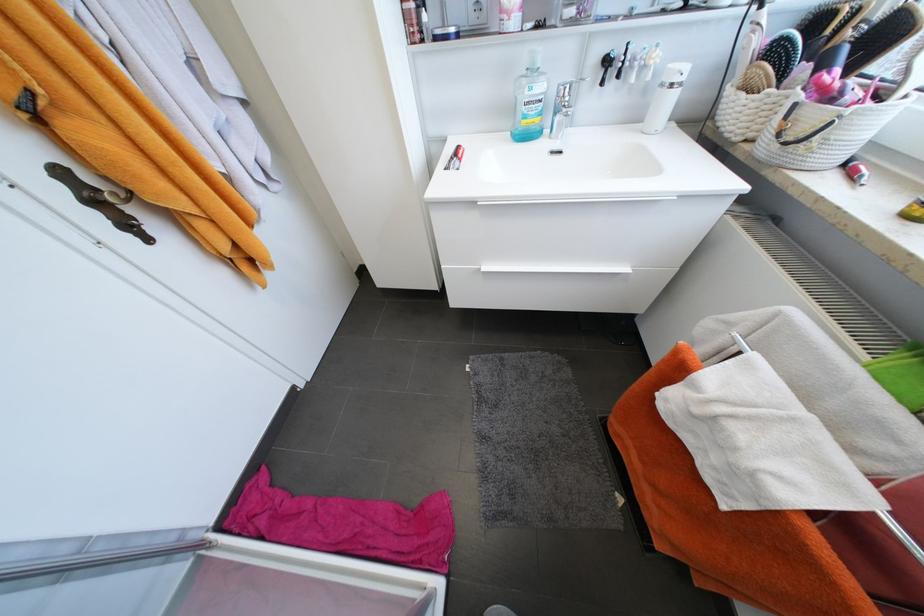
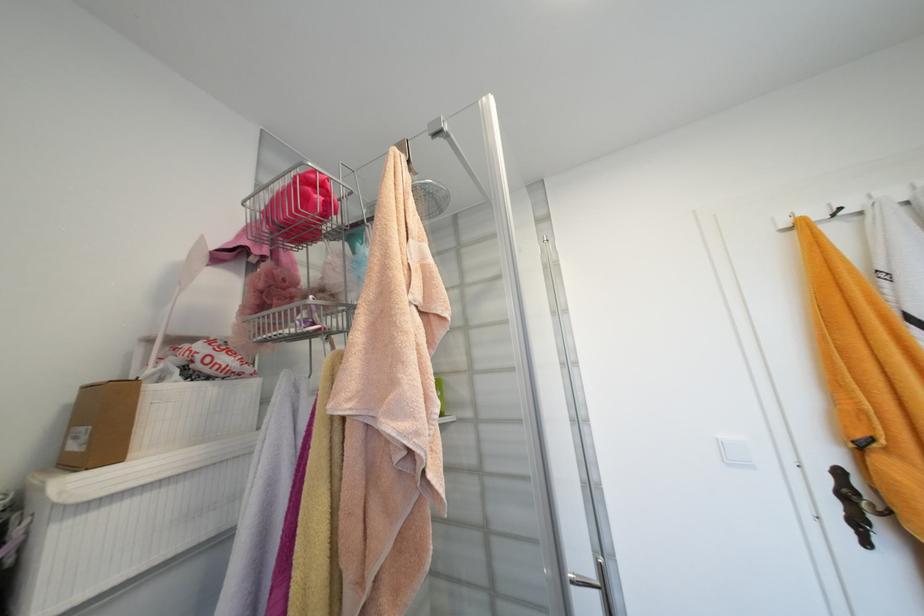
Question: The camera is either moving clockwise (left) or counter-clockwise (right) around the object. The first image is from the beginning of the video and the second image is from the end. Is the camera moving left or right when shooting the video?

Choices:
 (A) Left
 (B) Right

Answer: (B)